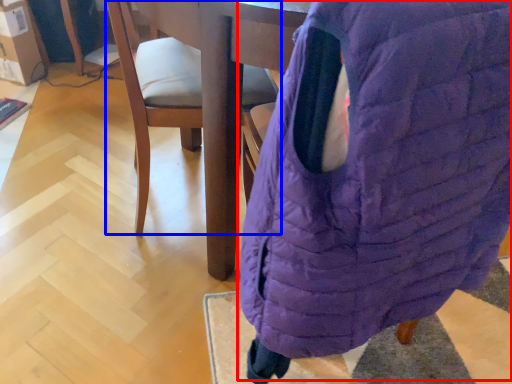
Question: Which point is closer to the camera, bean bag chair (highlighted by a red box) or chair (highlighted by a blue box)?

Choices:
 (A) bean bag chair
 (B) chair

Answer: (A)